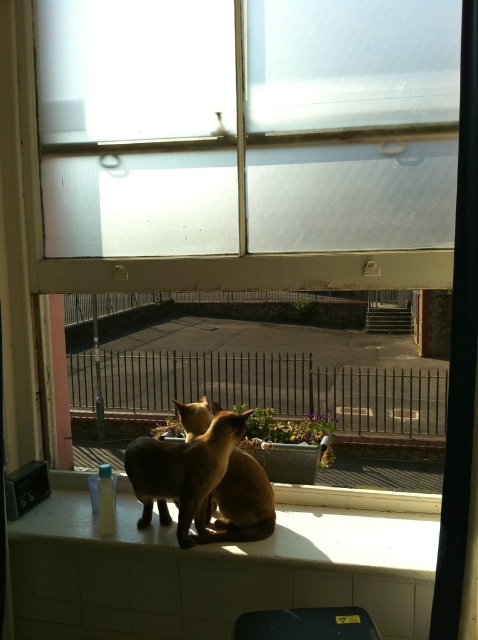
Question: Which object appears farthest from the camera in this image?

Choices:
 (A) satin brown cat at center
 (B) golden fur cat at center

Answer: (B)

Question: Is satin brown cat at center positioned in front of golden fur cat at center?

Choices:
 (A) no
 (B) yes

Answer: (B)

Question: Does satin brown cat at center have a smaller size compared to golden fur cat at center?

Choices:
 (A) no
 (B) yes

Answer: (A)

Question: Can you confirm if satin brown cat at center is positioned below golden fur cat at center?

Choices:
 (A) yes
 (B) no

Answer: (A)

Question: Which object is farther from the camera taking this photo?

Choices:
 (A) satin brown cat at center
 (B) golden fur cat at center

Answer: (B)